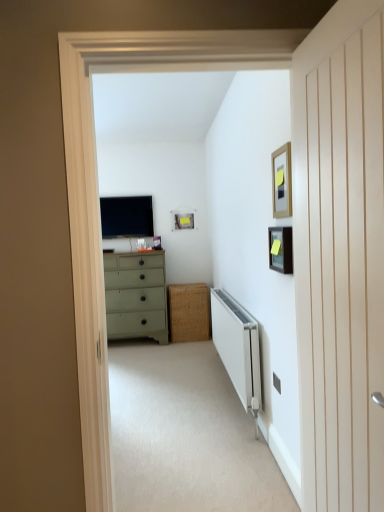
Question: Does matte black picture frame at upper center, the first picture frame in the back-to-front sequence, have a lesser height compared to beige carpet at center?

Choices:
 (A) yes
 (B) no

Answer: (B)

Question: Does matte black picture frame at upper center, which is counted as the third picture frame, starting from the right, have a lesser width compared to beige carpet at center?

Choices:
 (A) yes
 (B) no

Answer: (A)

Question: Is matte black picture frame at upper center, which ranks as the third picture frame in front-to-back order, to the left of beige carpet at center from the viewer's perspective?

Choices:
 (A) no
 (B) yes

Answer: (A)

Question: From a real-world perspective, is matte black picture frame at upper center, which is counted as the third picture frame, starting from the right, positioned under beige carpet at center based on gravity?

Choices:
 (A) yes
 (B) no

Answer: (B)

Question: Is beige carpet at center located within matte black picture frame at upper center, which is counted as the third picture frame, starting from the right?

Choices:
 (A) no
 (B) yes

Answer: (A)

Question: Considering the relative sizes of matte black picture frame at upper center, the first picture frame in the back-to-front sequence, and beige carpet at center in the image provided, is matte black picture frame at upper center, the first picture frame in the back-to-front sequence, wider than beige carpet at center?

Choices:
 (A) no
 (B) yes

Answer: (A)

Question: From the image's perspective, is matte black picture frame at upper right, the 2th picture frame in the back-to-front sequence, beneath wooden picture frame at upper right, which appears as the 3th picture frame when viewed from the left?

Choices:
 (A) yes
 (B) no

Answer: (A)

Question: Is matte black picture frame at upper right, positioned as the second picture frame in left-to-right order, in front of wooden picture frame at upper right, which appears as the 3th picture frame when viewed from the left?

Choices:
 (A) no
 (B) yes

Answer: (A)

Question: Considering the relative sizes of matte black picture frame at upper right, positioned as the second picture frame in right-to-left order, and wooden picture frame at upper right, positioned as the 1th picture frame in front-to-back order, in the image provided, is matte black picture frame at upper right, positioned as the second picture frame in right-to-left order, smaller than wooden picture frame at upper right, positioned as the 1th picture frame in front-to-back order,?

Choices:
 (A) yes
 (B) no

Answer: (A)

Question: Is matte black picture frame at upper right, the 2th picture frame in the back-to-front sequence, thinner than wooden picture frame at upper right, which is the first picture frame from right to left?

Choices:
 (A) no
 (B) yes

Answer: (A)

Question: Can you confirm if matte black picture frame at upper right, positioned as the second picture frame in left-to-right order, is bigger than wooden picture frame at upper right, which is the first picture frame from right to left?

Choices:
 (A) yes
 (B) no

Answer: (B)

Question: Is matte black picture frame at upper right, the 2th picture frame in the back-to-front sequence, taller than wooden picture frame at upper right, which is the first picture frame from right to left?

Choices:
 (A) no
 (B) yes

Answer: (A)

Question: Considering the relative sizes of wooden picture frame at upper right, positioned as the 1th picture frame in front-to-back order, and beige carpet at center in the image provided, is wooden picture frame at upper right, positioned as the 1th picture frame in front-to-back order, smaller than beige carpet at center?

Choices:
 (A) no
 (B) yes

Answer: (B)